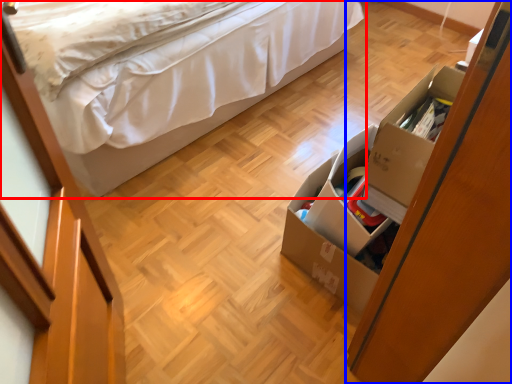
Question: Among these objects, which one is farthest to the camera, bed (highlighted by a red box) or dresser (highlighted by a blue box)?

Choices:
 (A) bed
 (B) dresser

Answer: (A)